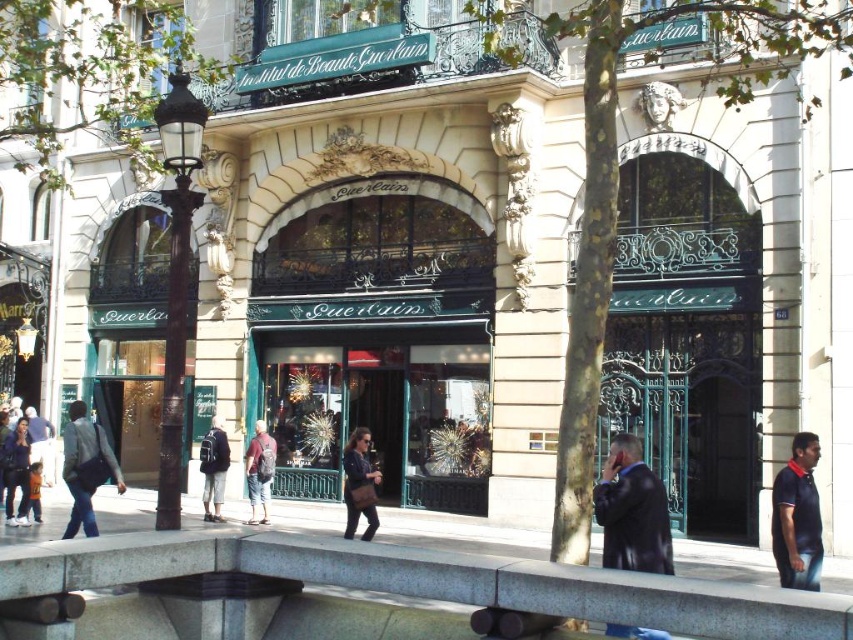
Looking at this image, you are standing in front of the Guerlain store and want to take a photo of both the point at coordinates point (96, 444) and point (206, 481). Which point should you focus on first to ensure both are in sharp focus?

You should focus on point (96, 444) first because it is closer to the camera than point (206, 481), ensuring both points are within the depth of field.

You are a customer entering the Guerlain store and see a dark blue leather jacket at lower left and a dark blue backpack at center. Which item is taller?

The dark blue leather jacket at lower left is much taller than the dark blue backpack at center.

You are standing in front of the Guerlain store and want to place a small potted plant exactly at the location marked by the gray concrete pavement at lower center. What are the coordinates where you should place it?

The gray concrete pavement at lower center is located at coordinates point (x=372, y=592), so you should place the small potted plant there.